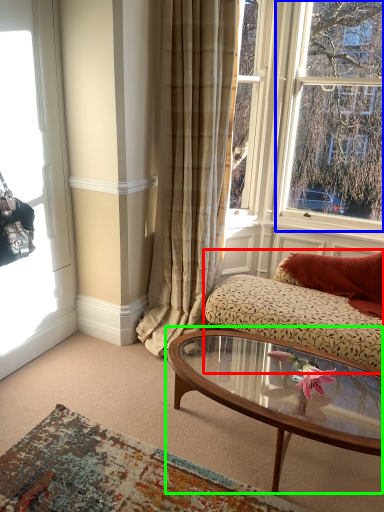
Question: Which object is the closest to the studio couch (highlighted by a red box)? Choose among these: window (highlighted by a blue box) or coffee table (highlighted by a green box).

Choices:
 (A) window
 (B) coffee table

Answer: (B)